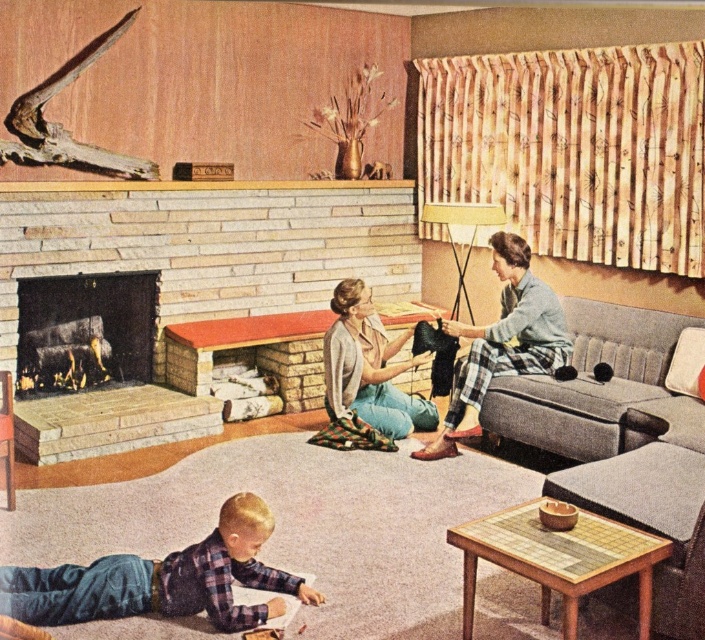
You are standing in the living room and want to place a new painting on the wall directly above the stone fireplace at center. According to the room layout, where should you position the painting in terms of coordinates?

The stone fireplace at center is located at coordinates (209, 243), so you should position the painting directly above these coordinates on the wall.